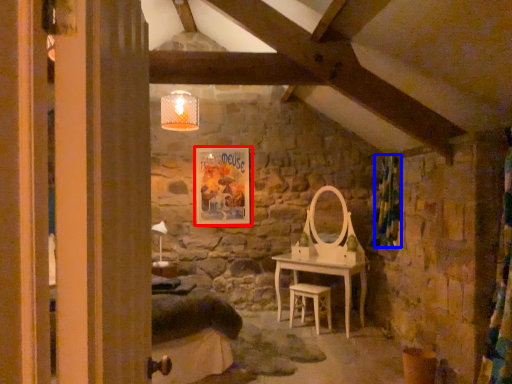
Question: Which point is closer to the camera, picture frame (highlighted by a red box) or curtain (highlighted by a blue box)?

Choices:
 (A) picture frame
 (B) curtain

Answer: (B)